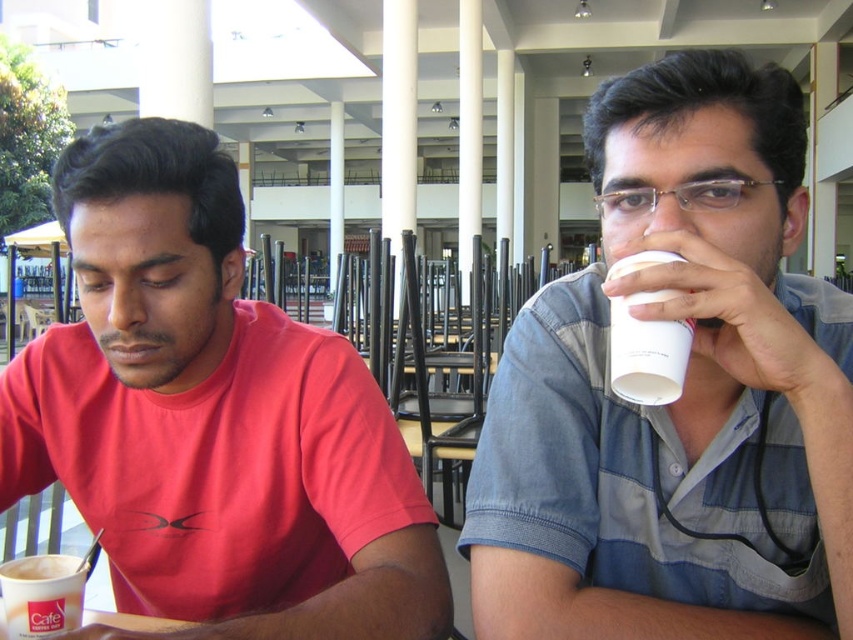
Is white paper cup at upper right thinner than white frothy coffee cup at lower left?

Indeed, white paper cup at upper right has a lesser width compared to white frothy coffee cup at lower left.

Identify the location of white paper cup at upper right. The image size is (853, 640). (647, 352).

Is matte red shirt at center closer to the viewer compared to white frothy coffee cup at lower left?

Yes, matte red shirt at center is closer to the viewer.

Between point (112, 134) and point (44, 596), which one is positioned in front?

Point (44, 596) is in front.

At what (x,y) coordinates should I click in order to perform the action: click on matte red shirt at center. Please return your answer as a coordinate pair (x, y). Looking at the image, I should click on (212, 419).

Is the position of white paper cup at upper center more distant than that of white paper cup at upper right?

No, it is not.

I want to click on white paper cup at upper center, so click(682, 394).